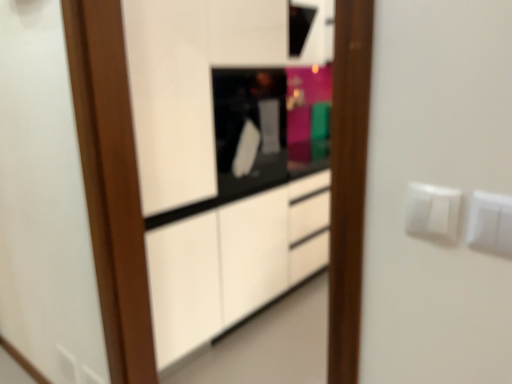
Question: Can you confirm if white plastic switch at upper right, which is the second electric outlet from front to back, is positioned to the right of white plastic electric outlet at lower left, the first electric outlet in the back-to-front sequence?

Choices:
 (A) no
 (B) yes

Answer: (B)

Question: Is white plastic switch at upper right, marked as the 3th electric outlet in a bottom-to-top arrangement, positioned in front of white plastic electric outlet at lower left, which is the third electric outlet in front-to-back order?

Choices:
 (A) yes
 (B) no

Answer: (A)

Question: Is white plastic switch at upper right, the second electric outlet from the back, aimed at white plastic electric outlet at lower left, which is the third electric outlet in front-to-back order?

Choices:
 (A) no
 (B) yes

Answer: (A)

Question: Considering the relative sizes of white plastic switch at upper right, the second electric outlet from the back, and white plastic electric outlet at lower left, which is the third electric outlet in front-to-back order, in the image provided, is white plastic switch at upper right, the second electric outlet from the back, taller than white plastic electric outlet at lower left, which is the third electric outlet in front-to-back order,?

Choices:
 (A) yes
 (B) no

Answer: (B)

Question: Is white plastic electric outlet at lower left, the 3th electric outlet from the right, completely or partially inside white plastic switch at upper right, positioned as the second electric outlet in right-to-left order?

Choices:
 (A) yes
 (B) no

Answer: (B)

Question: From the image's perspective, is white plastic switch at upper right, the second electric outlet from the back, located above white plastic electric outlet at lower left, positioned as the 1th electric outlet in left-to-right order?

Choices:
 (A) yes
 (B) no

Answer: (A)

Question: Does black glossy microwave at center appear on the right side of white plastic electric outlet at right, which is the 1th electric outlet in right-to-left order?

Choices:
 (A) yes
 (B) no

Answer: (B)

Question: Is black glossy microwave at center directly adjacent to white plastic electric outlet at right, which is counted as the 3th electric outlet, starting from the back?

Choices:
 (A) no
 (B) yes

Answer: (A)

Question: Considering the relative sizes of black glossy microwave at center and white plastic electric outlet at right, the second electric outlet when ordered from top to bottom, in the image provided, is black glossy microwave at center thinner than white plastic electric outlet at right, the second electric outlet when ordered from top to bottom,?

Choices:
 (A) yes
 (B) no

Answer: (B)

Question: Considering the relative sizes of black glossy microwave at center and white plastic electric outlet at right, marked as the 3th electric outlet in a left-to-right arrangement, in the image provided, is black glossy microwave at center bigger than white plastic electric outlet at right, marked as the 3th electric outlet in a left-to-right arrangement,?

Choices:
 (A) no
 (B) yes

Answer: (B)

Question: Does black glossy microwave at center have a lesser height compared to white plastic electric outlet at right, the second electric outlet when ordered from top to bottom?

Choices:
 (A) no
 (B) yes

Answer: (A)

Question: From a real-world perspective, is black glossy microwave at center physically above white plastic electric outlet at right, the second electric outlet when ordered from top to bottom?

Choices:
 (A) no
 (B) yes

Answer: (A)

Question: From the image's perspective, is white plastic electric outlet at lower left, which is the third electric outlet in front-to-back order, located beneath black glossy microwave at center?

Choices:
 (A) no
 (B) yes

Answer: (B)